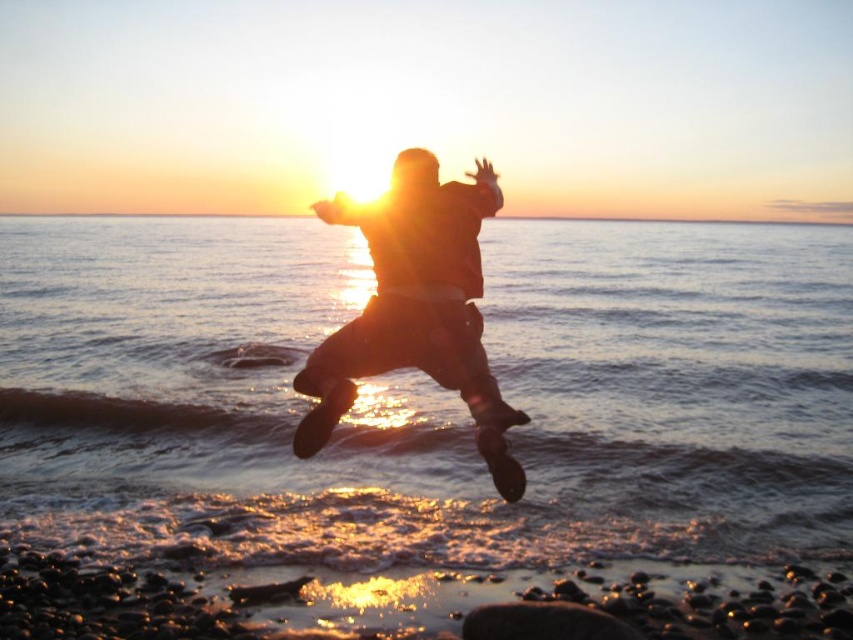
Question: Among these objects, which one is nearest to the camera?

Choices:
 (A) silhouette leather jacket at center
 (B) translucent water at center

Answer: (A)

Question: Is translucent water at center to the left of silhouette leather jacket at center from the viewer's perspective?

Choices:
 (A) yes
 (B) no

Answer: (B)

Question: Among these objects, which one is farthest from the camera?

Choices:
 (A) translucent water at center
 (B) silhouette leather jacket at center

Answer: (A)

Question: Can you confirm if translucent water at center is positioned above silhouette leather jacket at center?

Choices:
 (A) no
 (B) yes

Answer: (B)

Question: Can you confirm if translucent water at center is wider than silhouette leather jacket at center?

Choices:
 (A) yes
 (B) no

Answer: (A)